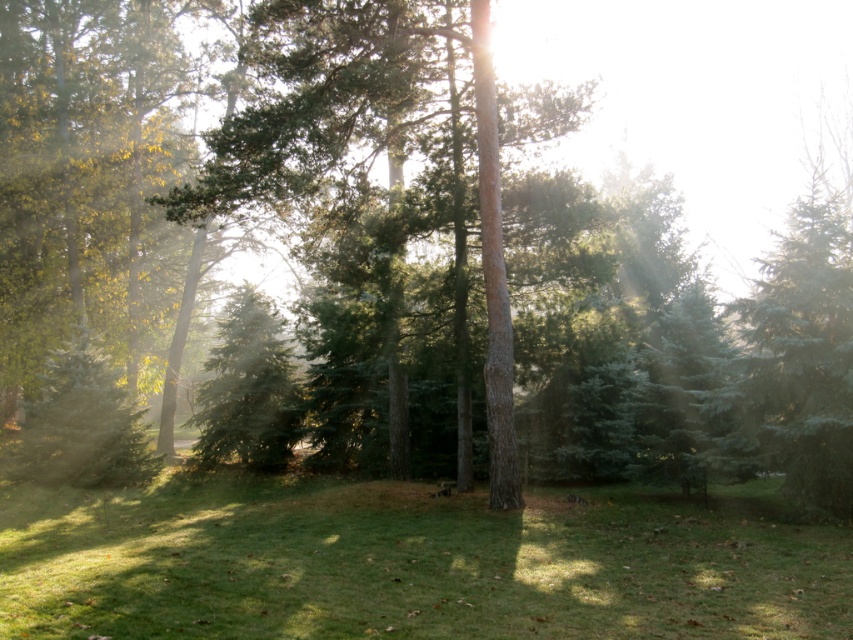
Question: Is green grass at center wider than green matte tree at center?

Choices:
 (A) yes
 (B) no

Answer: (A)

Question: Is green grass at center below green matte tree at center?

Choices:
 (A) no
 (B) yes

Answer: (B)

Question: Which of the following is the closest to the observer?

Choices:
 (A) green matte tree at center
 (B) green grass at center

Answer: (B)

Question: From the image, what is the correct spatial relationship of green grass at center in relation to green matte tree at center?

Choices:
 (A) right
 (B) left

Answer: (A)